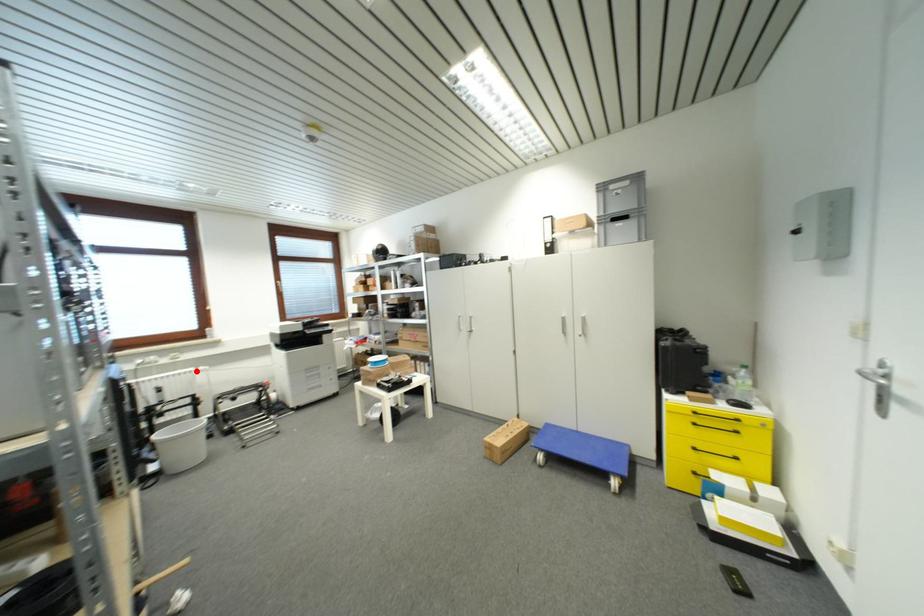
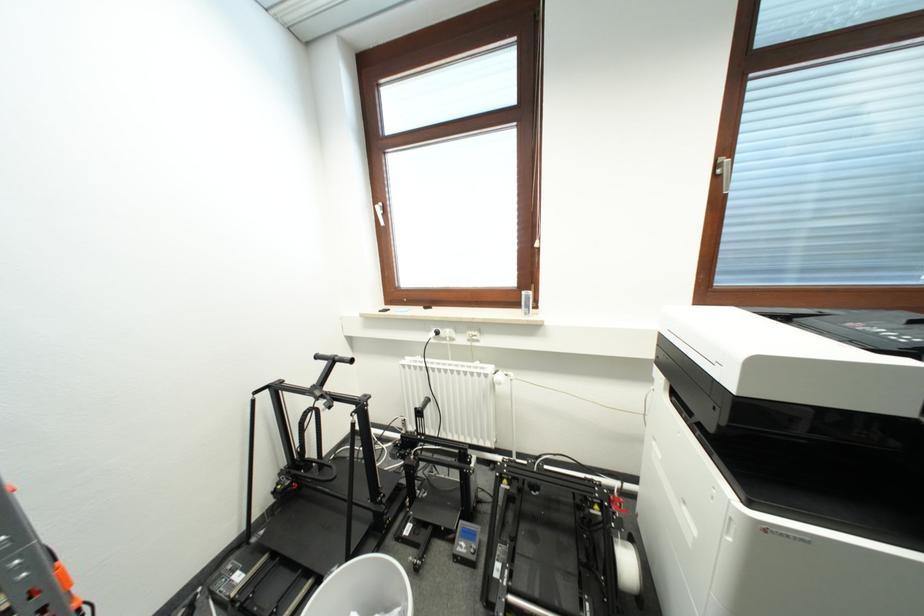
The point at the highlighted location is marked in the first image. Where is the corresponding point in the second image?

(494, 371)